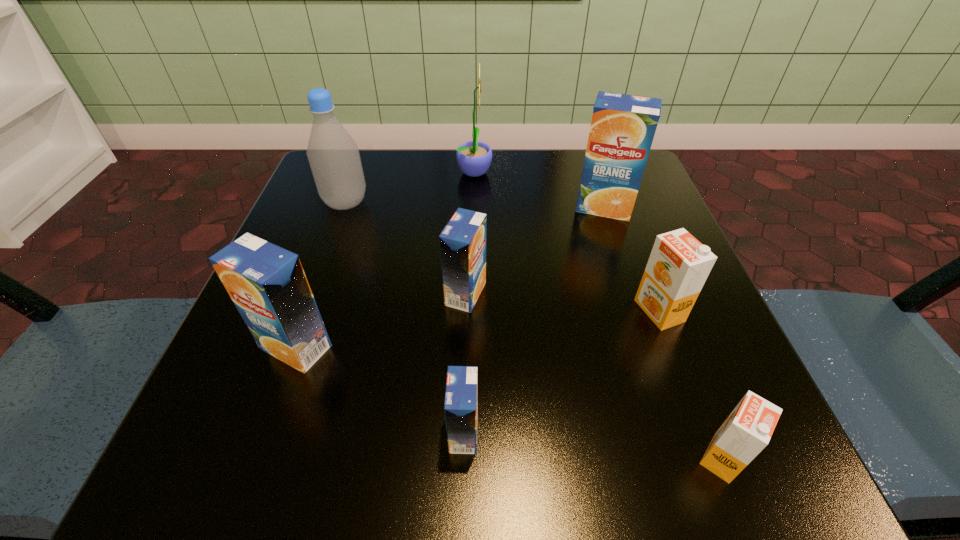
Find the location of a particular element. The height and width of the screenshot is (540, 960). vacant region located on the front-facing side of the sunflower is located at coordinates (564, 171).

Where is `vacant area situated 0.230m on the right of the gray bottle`? This screenshot has width=960, height=540. vacant area situated 0.230m on the right of the gray bottle is located at coordinates pos(481,202).

Where is `vacant space located on the left of the farthest orange juice`? Image resolution: width=960 pixels, height=540 pixels. vacant space located on the left of the farthest orange juice is located at coordinates (435, 207).

Find the location of `free point located 0.200m on the back of the fourth tallest object`. free point located 0.200m on the back of the fourth tallest object is located at coordinates (335, 239).

At what (x,y) coordinates should I click in order to perform the action: click on vacant area located 0.050m on the left of the farther orange orange juice. Please return your answer as a coordinate pair (x, y). This screenshot has width=960, height=540. Looking at the image, I should click on (606, 311).

I want to click on vacant space positioned on the left of the third nearest blue orange_juice, so click(305, 294).

Locate an element on the screen. The height and width of the screenshot is (540, 960). vacant space located 0.200m on the right of the smallest blue orange_juice is located at coordinates (636, 433).

Where is `vacant space located on the back of the nearer orange orange juice`? The height and width of the screenshot is (540, 960). vacant space located on the back of the nearer orange orange juice is located at coordinates (663, 307).

What are the coordinates of `sunflower located at the far edge` in the screenshot? It's located at (474, 158).

In order to click on bottle that is positioned at the far edge in this screenshot , I will do `click(334, 158)`.